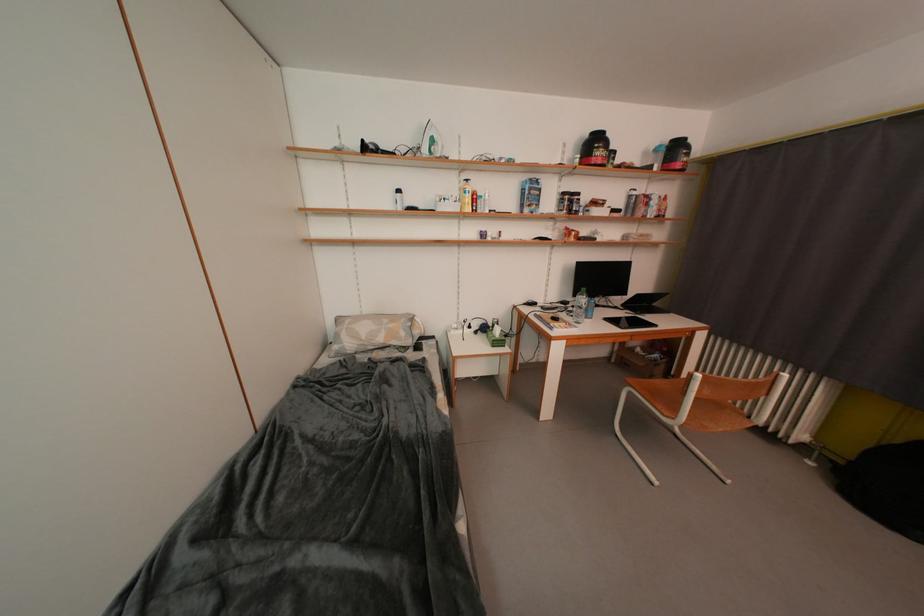
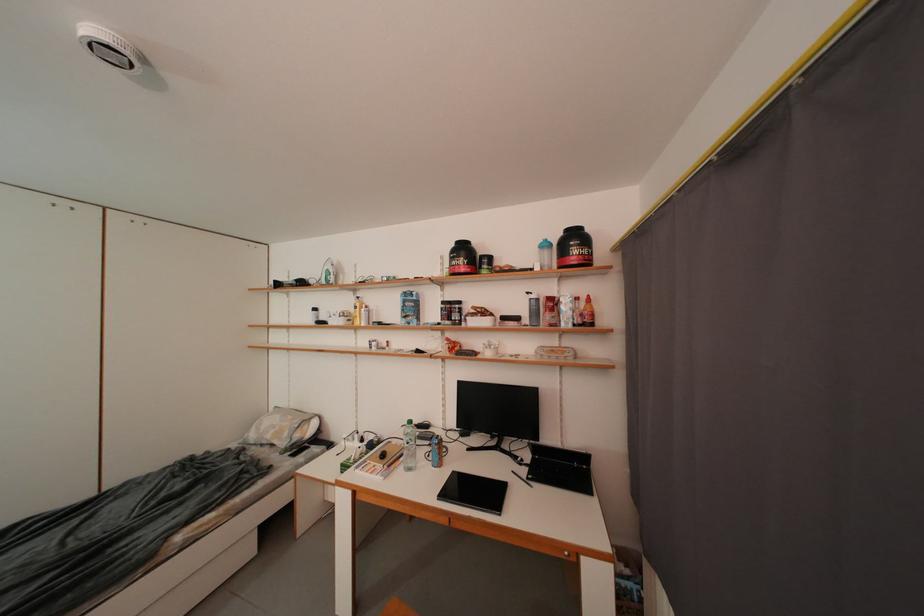
The point at (409, 337) is marked in the first image. Where is the corresponding point in the second image?

(294, 438)